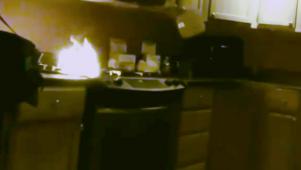
Image resolution: width=301 pixels, height=170 pixels. Find the location of `wall`. wall is located at coordinates (271, 46), (44, 16).